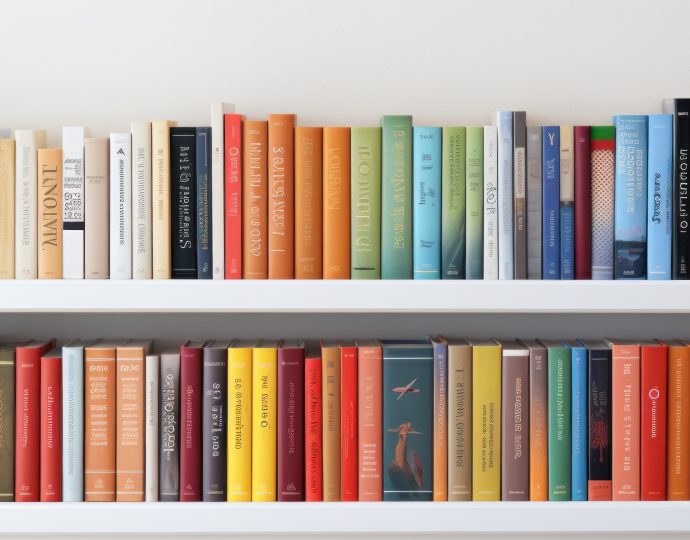
Where is `red books`? This screenshot has width=690, height=540. red books is located at coordinates (21, 408), (46, 405), (312, 408), (348, 421), (653, 427), (230, 178).